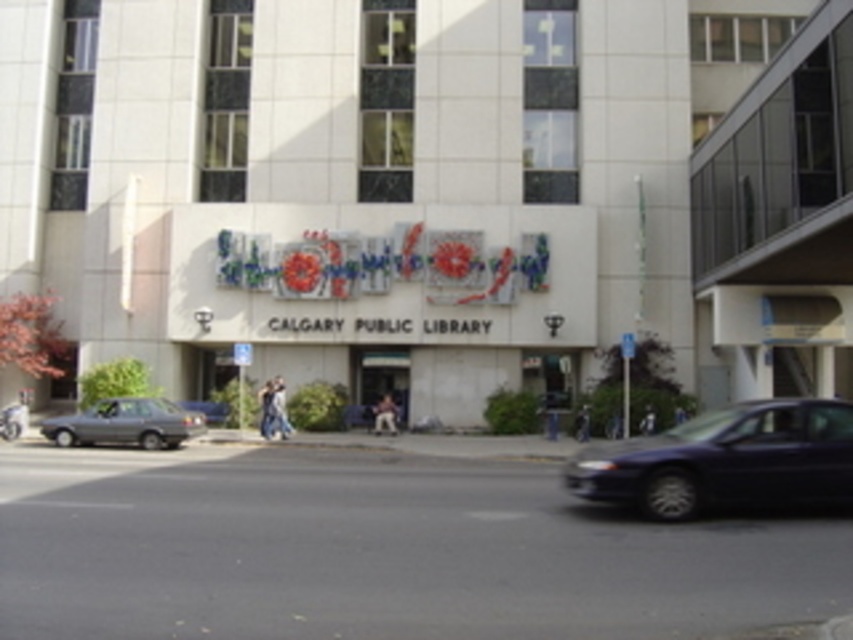
Which is below, metallic gray car at center or dark blue sedan at lower right?

Positioned lower is dark blue sedan at lower right.

Is metallic gray car at center to the right of dark blue sedan at lower right from the viewer's perspective?

No, metallic gray car at center is not to the right of dark blue sedan at lower right.

The width and height of the screenshot is (853, 640). What are the coordinates of `metallic gray car at center` in the screenshot? It's located at (383, 552).

Which is more to the left, dark blue sedan at lower right or matte gray sedan at lower left?

matte gray sedan at lower left is more to the left.

Is dark blue sedan at lower right to the right of matte gray sedan at lower left from the viewer's perspective?

Yes, dark blue sedan at lower right is to the right of matte gray sedan at lower left.

Which is behind, point (570, 458) or point (151, 426)?

The point (151, 426) is behind.

Where is `dark blue sedan at lower right`? This screenshot has width=853, height=640. dark blue sedan at lower right is located at coordinates (724, 460).

Can you confirm if metallic gray car at center is wider than matte gray sedan at lower left?

Correct, the width of metallic gray car at center exceeds that of matte gray sedan at lower left.

Which of these two, metallic gray car at center or matte gray sedan at lower left, stands shorter?

matte gray sedan at lower left is shorter.

Identify the location of metallic gray car at center. The image size is (853, 640). (383, 552).

This screenshot has width=853, height=640. I want to click on metallic gray car at center, so (x=383, y=552).